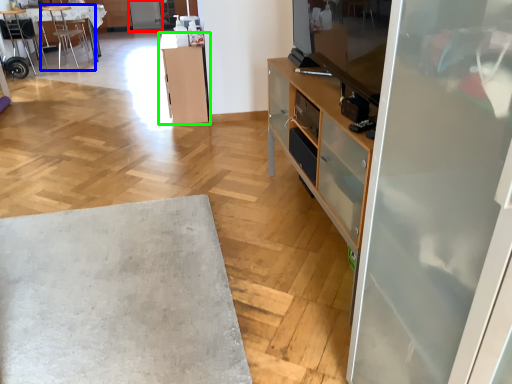
Question: Considering the real-world distances, which object is closest to screen door (highlighted by a red box)? chair (highlighted by a blue box) or cabinetry (highlighted by a green box).

Choices:
 (A) chair
 (B) cabinetry

Answer: (A)